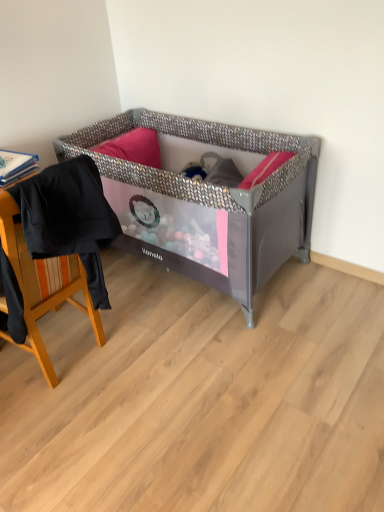
Question: Is metallic gray playpen at center taller than black fabric chair at left?

Choices:
 (A) no
 (B) yes

Answer: (B)

Question: Does metallic gray playpen at center have a lesser height compared to black fabric chair at left?

Choices:
 (A) yes
 (B) no

Answer: (B)

Question: Is metallic gray playpen at center bigger than black fabric chair at left?

Choices:
 (A) yes
 (B) no

Answer: (A)

Question: Is metallic gray playpen at center behind black fabric chair at left?

Choices:
 (A) yes
 (B) no

Answer: (A)

Question: Is metallic gray playpen at center oriented away from black fabric chair at left?

Choices:
 (A) yes
 (B) no

Answer: (B)

Question: Is metallic gray playpen at center surrounding black fabric chair at left?

Choices:
 (A) no
 (B) yes

Answer: (A)

Question: Does black fabric chair at left touch metallic gray playpen at center?

Choices:
 (A) yes
 (B) no

Answer: (B)

Question: From the image's perspective, is black fabric chair at left under metallic gray playpen at center?

Choices:
 (A) no
 (B) yes

Answer: (B)

Question: Considering the relative positions of black fabric chair at left and metallic gray playpen at center in the image provided, is black fabric chair at left behind metallic gray playpen at center?

Choices:
 (A) no
 (B) yes

Answer: (A)

Question: Does black fabric chair at left have a greater height compared to metallic gray playpen at center?

Choices:
 (A) yes
 (B) no

Answer: (B)

Question: Is black fabric chair at left to the right of metallic gray playpen at center from the viewer's perspective?

Choices:
 (A) yes
 (B) no

Answer: (B)

Question: Considering the relative sizes of black fabric chair at left and metallic gray playpen at center in the image provided, is black fabric chair at left smaller than metallic gray playpen at center?

Choices:
 (A) no
 (B) yes

Answer: (B)

Question: Looking at their shapes, would you say black fabric chair at left is wider or thinner than metallic gray playpen at center?

Choices:
 (A) wide
 (B) thin

Answer: (B)